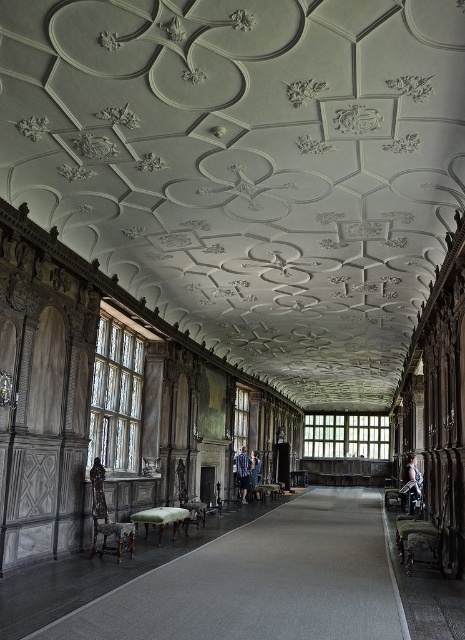
Can you confirm if smooth skin figure at center is thinner than blue denim jeans at center?

In fact, smooth skin figure at center might be wider than blue denim jeans at center.

Who is lower down, smooth skin figure at center or blue denim jeans at center?

Positioned lower is blue denim jeans at center.

Measure the distance between smooth skin figure at center and camera.

smooth skin figure at center and camera are 16.32 meters apart from each other.

At what (x,y) coordinates should I click in order to perform the action: click on smooth skin figure at center. Please return your answer as a coordinate pair (x, y). Looking at the image, I should click on (412, 481).

Who is taller, dark brown leather chair at left or blue denim jeans at center?

blue denim jeans at center is taller.

Does dark brown leather chair at left have a greater height compared to blue denim jeans at center?

Incorrect, dark brown leather chair at left's height is not larger of blue denim jeans at center's.

Which is behind, point (95, 496) or point (252, 451)?

Positioned behind is point (252, 451).

At what (x,y) coordinates should I click in order to perform the action: click on dark brown leather chair at left. Please return your answer as a coordinate pair (x, y). Looking at the image, I should click on (98, 492).

Does dark brown leather chair at left have a lesser height compared to smooth skin figure at center?

Correct, dark brown leather chair at left is not as tall as smooth skin figure at center.

Can you confirm if dark brown leather chair at left is wider than smooth skin figure at center?

In fact, dark brown leather chair at left might be narrower than smooth skin figure at center.

The height and width of the screenshot is (640, 465). I want to click on dark brown leather chair at left, so click(98, 492).

What are the coordinates of `dark brown leather chair at left` in the screenshot? It's located at (98, 492).